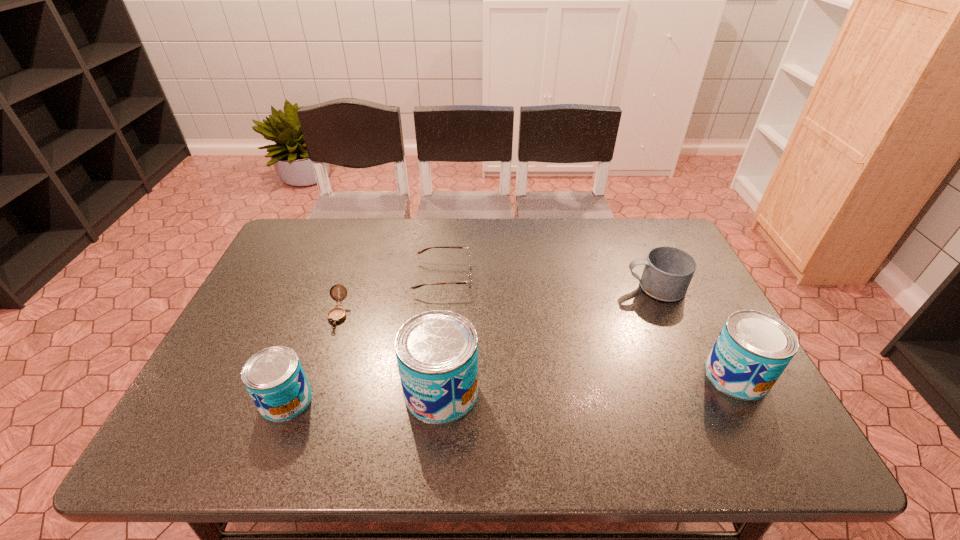
I want to click on free area in between the tallest can and the fourth tallest object, so click(x=548, y=339).

Locate an element on the screen. unoccupied area between the tallest can and the compass is located at coordinates (390, 353).

Where is `empty space that is in between the shortest can and the second tallest object`? The width and height of the screenshot is (960, 540). empty space that is in between the shortest can and the second tallest object is located at coordinates click(x=512, y=388).

The width and height of the screenshot is (960, 540). What are the coordinates of `free spot between the spectacles and the mug` in the screenshot? It's located at (549, 282).

Locate an element on the screen. This screenshot has width=960, height=540. free space between the third shortest object and the compass is located at coordinates (496, 301).

Find the location of `vacant area that lies between the second shortest can and the second can from left to right`. vacant area that lies between the second shortest can and the second can from left to right is located at coordinates (588, 383).

The image size is (960, 540). Find the location of `free space between the compass and the rightmost can`. free space between the compass and the rightmost can is located at coordinates (538, 345).

The width and height of the screenshot is (960, 540). Identify the location of free space between the spectacles and the shortest can. (365, 338).

The height and width of the screenshot is (540, 960). Find the location of `object that is the fifth closest to the mug`. object that is the fifth closest to the mug is located at coordinates (274, 377).

Locate which object ranks fourth in proximity to the compass. Please provide its 2D coordinates. Your answer should be formatted as a tuple, i.e. [(x, y)], where the tuple contains the x and y coordinates of a point satisfying the conditions above.

[(668, 271)]